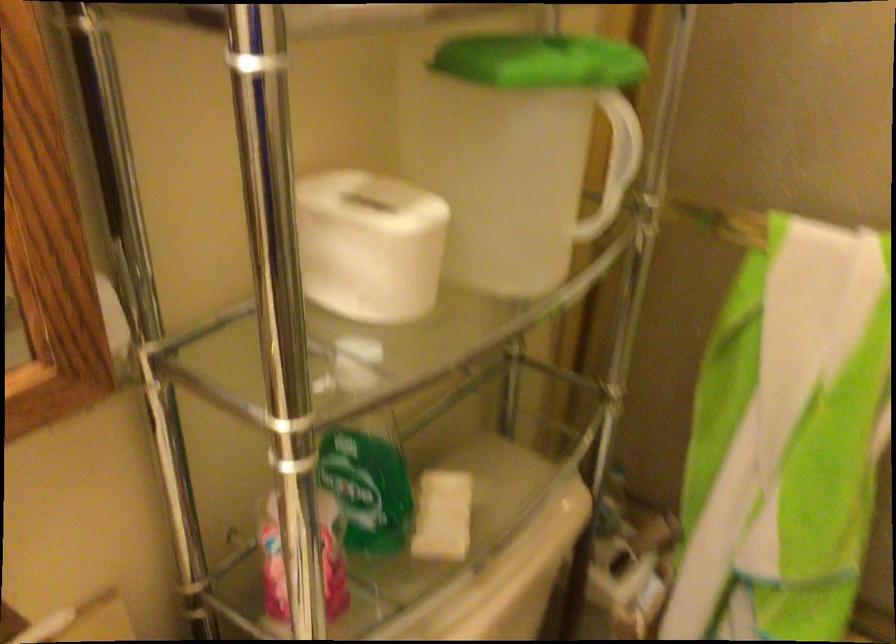
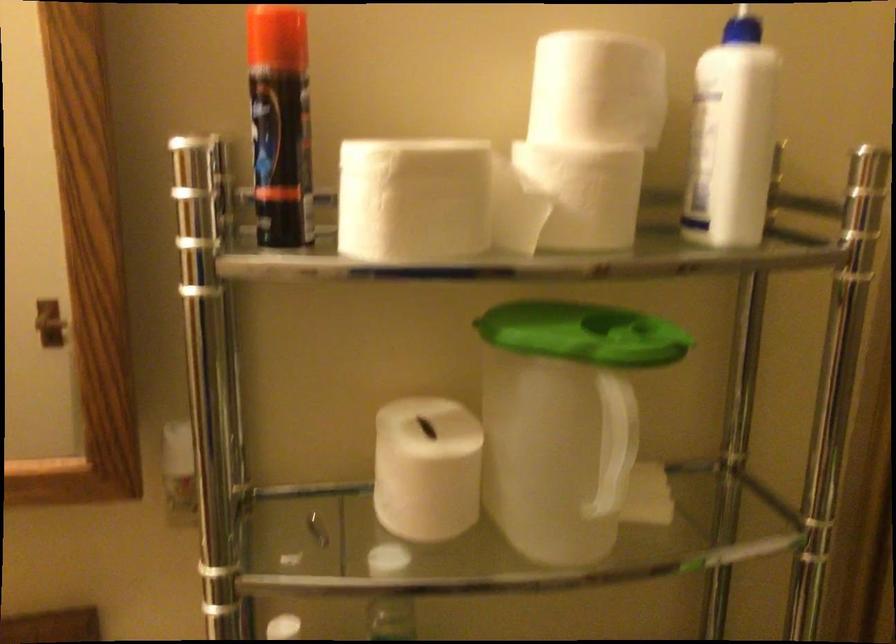
Locate, in the second image, the point that corresponds to [421,242] in the first image.

(426, 469)